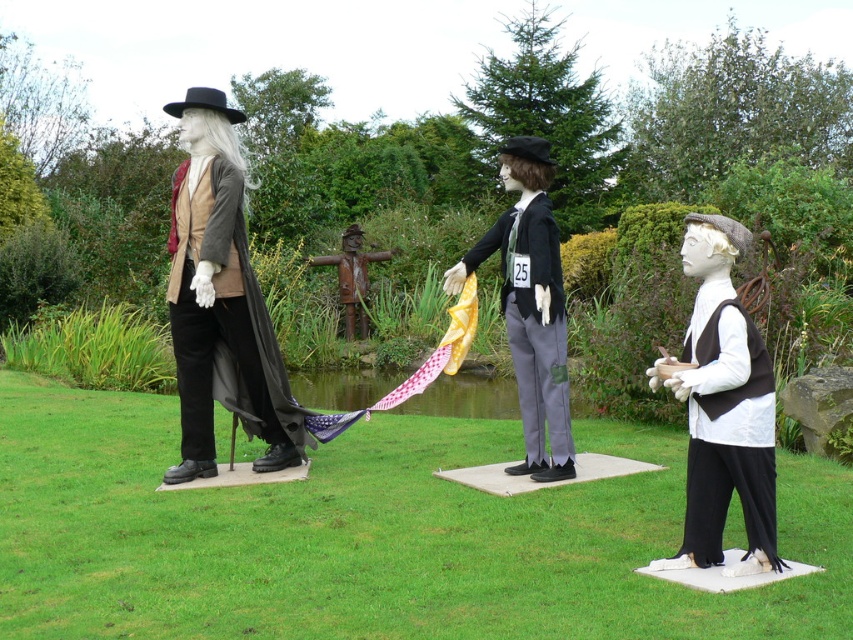
Does matte black coat at left appear over matte black vest at right?

Indeed, matte black coat at left is positioned over matte black vest at right.

Does matte black coat at left appear on the right side of matte black vest at right?

In fact, matte black coat at left is to the left of matte black vest at right.

At what (x,y) coordinates should I click in order to perform the action: click on matte black coat at left. Please return your answer as a coordinate pair (x, y). The image size is (853, 640). Looking at the image, I should click on (221, 301).

In the scene shown: Does matte black coat at left appear on the right side of rusty metal scarecrow at center?

Indeed, matte black coat at left is positioned on the right side of rusty metal scarecrow at center.

Does matte black coat at left have a larger size compared to rusty metal scarecrow at center?

No, matte black coat at left is not bigger than rusty metal scarecrow at center.

Is point (183, 228) positioned after point (367, 324)?

That is False.

You are a GUI agent. You are given a task and a screenshot of the screen. Output one action in this format:
    pyautogui.click(x=<x>, y=<y>)
    Task: Click on the matte black coat at left
    
    Given the screenshot: What is the action you would take?
    pyautogui.click(x=221, y=301)

Is matte black vest at right positioned in front of matte black suit at center?

Yes, it is.

Who is positioned more to the right, matte black vest at right or matte black suit at center?

Positioned to the right is matte black vest at right.

Does point (732, 468) come farther from viewer compared to point (537, 472)?

No, it is in front of (537, 472).

In order to click on matte black vest at right in this screenshot , I will do `click(722, 406)`.